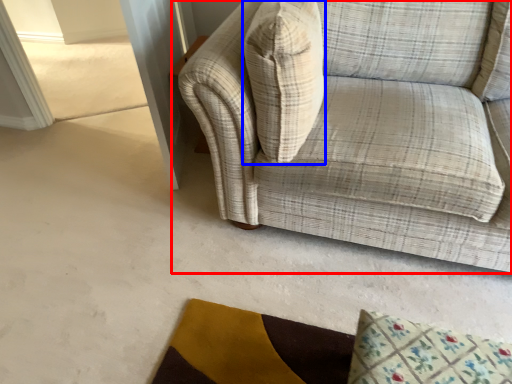
Question: Which point is closer to the camera, studio couch (highlighted by a red box) or throw pillow (highlighted by a blue box)?

Choices:
 (A) studio couch
 (B) throw pillow

Answer: (A)